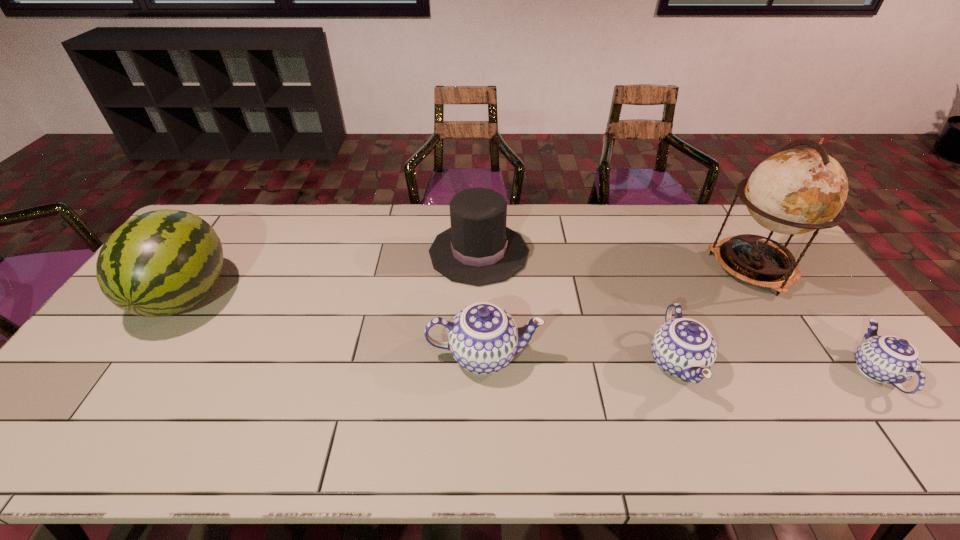
Locate an element on the screen. Image resolution: width=960 pixels, height=540 pixels. globe that is at the right edge is located at coordinates (795, 191).

Identify the location of object located at the far right corner. The width and height of the screenshot is (960, 540). (795, 191).

Locate an element on the screen. The image size is (960, 540). object at the near right corner is located at coordinates (889, 359).

In the image, there is a desktop. Where is `vacant region at the far edge`? vacant region at the far edge is located at coordinates (304, 244).

Find the location of `free space at the near edge`. free space at the near edge is located at coordinates (269, 409).

Where is `free region at the right edge`? This screenshot has width=960, height=540. free region at the right edge is located at coordinates (847, 332).

Where is `free point at the far left corner`? The height and width of the screenshot is (540, 960). free point at the far left corner is located at coordinates (218, 206).

You are a GUI agent. You are given a task and a screenshot of the screen. Output one action in this format:
    pyautogui.click(x=<x>, y=<y>)
    Task: Click on the empty space that is in between the watermelon and the tallest chinaware
    The image size is (960, 540).
    Given the screenshot: What is the action you would take?
    tap(335, 325)

The image size is (960, 540). I want to click on empty space that is in between the globe and the leftmost chinaware, so click(618, 312).

The image size is (960, 540). What are the coordinates of `vacant space in between the second tallest chinaware and the shortest chinaware` in the screenshot? It's located at (776, 367).